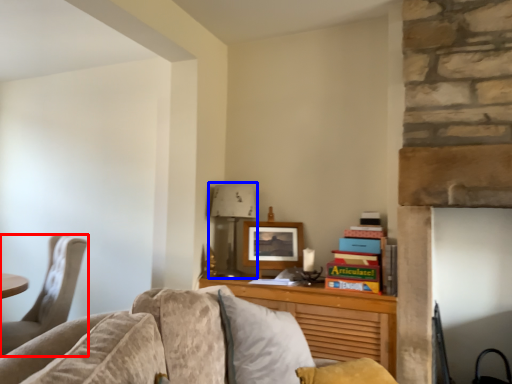
Question: Which of the following is the farthest to the observer, chair (highlighted by a red box) or lamp (highlighted by a blue box)?

Choices:
 (A) chair
 (B) lamp

Answer: (B)